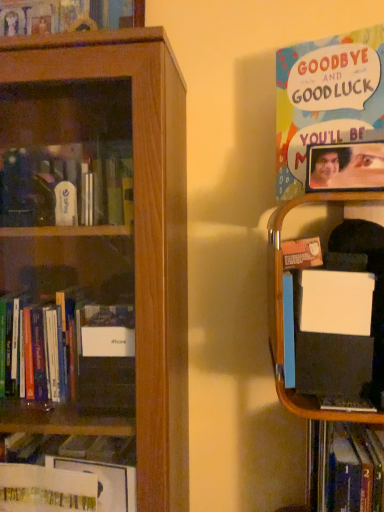
This screenshot has width=384, height=512. Find the location of `hardcover book at lower right, the first book when ordered from bottom to top`. hardcover book at lower right, the first book when ordered from bottom to top is located at coordinates (344, 468).

The height and width of the screenshot is (512, 384). Describe the element at coordinates (95, 263) in the screenshot. I see `wooden bookcase at left` at that location.

The width and height of the screenshot is (384, 512). I want to click on wooden bookcase at left, so click(95, 263).

At what (x,y) coordinates should I click in order to perform the action: click on hardcover book at lower right, marked as the second book in a top-to-bottom arrangement. Please return your answer as a coordinate pair (x, y). The height and width of the screenshot is (512, 384). Looking at the image, I should click on (344, 468).

Can you confirm if wooden bookcase at left is wider than hardcover book at lower right, marked as the second book in a top-to-bottom arrangement?

Yes, wooden bookcase at left is wider than hardcover book at lower right, marked as the second book in a top-to-bottom arrangement.

From the picture: Considering their positions, is wooden bookcase at left located in front of or behind hardcover book at lower right, the first book when ordered from bottom to top?

Visually, wooden bookcase at left is located in front of hardcover book at lower right, the first book when ordered from bottom to top.

What's the angular difference between wooden bookcase at left and hardcover book at lower right, marked as the second book in a top-to-bottom arrangement,'s facing directions?

The facing directions of wooden bookcase at left and hardcover book at lower right, marked as the second book in a top-to-bottom arrangement, are 6.29 degrees apart.

Does wooden bookcase at left turn towards hardcover book at lower right, the first book when ordered from bottom to top?

No, wooden bookcase at left is not aimed at hardcover book at lower right, the first book when ordered from bottom to top.

Is hardcover book at lower right, the first book when ordered from bottom to top, looking in the opposite direction of multicolored paper poster at upper right, the second book when ordered from bottom to top?

hardcover book at lower right, the first book when ordered from bottom to top, does not have its back to multicolored paper poster at upper right, the second book when ordered from bottom to top.

Can you confirm if hardcover book at lower right, marked as the second book in a top-to-bottom arrangement, is taller than multicolored paper poster at upper right, the second book when ordered from bottom to top?

Yes, hardcover book at lower right, marked as the second book in a top-to-bottom arrangement, is taller than multicolored paper poster at upper right, the second book when ordered from bottom to top.

Considering the positions of objects hardcover book at lower right, marked as the second book in a top-to-bottom arrangement, and multicolored paper poster at upper right, the second book when ordered from bottom to top, in the image provided, who is more to the left, hardcover book at lower right, marked as the second book in a top-to-bottom arrangement, or multicolored paper poster at upper right, the second book when ordered from bottom to top,?

Positioned to the left is multicolored paper poster at upper right, the second book when ordered from bottom to top.

From a real-world perspective, is hardcover book at lower right, marked as the second book in a top-to-bottom arrangement, physically located above or below multicolored paper poster at upper right, positioned as the first book in top-to-bottom order?

From a real-world perspective, hardcover book at lower right, marked as the second book in a top-to-bottom arrangement, is physically below multicolored paper poster at upper right, positioned as the first book in top-to-bottom order.

Is multicolored paper poster at upper right, positioned as the first book in top-to-bottom order, looking in the opposite direction of hardcover book at lower right, the first book when ordered from bottom to top?

That's not correct — multicolored paper poster at upper right, positioned as the first book in top-to-bottom order, is not looking away from hardcover book at lower right, the first book when ordered from bottom to top.

Considering the relative sizes of multicolored paper poster at upper right, positioned as the first book in top-to-bottom order, and hardcover book at lower right, the first book when ordered from bottom to top, in the image provided, is multicolored paper poster at upper right, positioned as the first book in top-to-bottom order, thinner than hardcover book at lower right, the first book when ordered from bottom to top,?

Result: Indeed, multicolored paper poster at upper right, positioned as the first book in top-to-bottom order, has a lesser width compared to hardcover book at lower right, the first book when ordered from bottom to top.

Considering the relative positions of multicolored paper poster at upper right, positioned as the first book in top-to-bottom order, and hardcover book at lower right, the first book when ordered from bottom to top, in the image provided, is multicolored paper poster at upper right, positioned as the first book in top-to-bottom order, behind hardcover book at lower right, the first book when ordered from bottom to top,?

Yes, it is behind hardcover book at lower right, the first book when ordered from bottom to top.

Can wooden picture frame at upper right be found inside hardcover book at lower right, the first book when ordered from bottom to top?

No.

Identify the location of picture frame in front of the hardcover book at lower right, the first book when ordered from bottom to top. (345, 167).

How different are the orientations of hardcover book at lower right, marked as the second book in a top-to-bottom arrangement, and wooden picture frame at upper right in degrees?

They differ by 5.22 degrees in their facing directions.

From a real-world perspective, is hardcover book at lower right, marked as the second book in a top-to-bottom arrangement, positioned above or below wooden picture frame at upper right?

hardcover book at lower right, marked as the second book in a top-to-bottom arrangement, is below wooden picture frame at upper right.

Could you tell me if hardcover book at lower right, the first book when ordered from bottom to top, is turned towards wooden bookcase at left?

No, hardcover book at lower right, the first book when ordered from bottom to top, is not oriented towards wooden bookcase at left.

Considering the relative sizes of hardcover book at lower right, marked as the second book in a top-to-bottom arrangement, and wooden bookcase at left in the image provided, is hardcover book at lower right, marked as the second book in a top-to-bottom arrangement, smaller than wooden bookcase at left?

Yes, hardcover book at lower right, marked as the second book in a top-to-bottom arrangement, is smaller than wooden bookcase at left.

Is hardcover book at lower right, the first book when ordered from bottom to top, to the left or to the right of wooden bookcase at left in the image?

Clearly, hardcover book at lower right, the first book when ordered from bottom to top, is on the right of wooden bookcase at left in the image.

Is point (315, 437) positioned in front of point (136, 111)?

That is False.

Considering the sizes of wooden bookcase at left and wooden picture frame at upper right in the image, is wooden bookcase at left wider or thinner than wooden picture frame at upper right?

wooden bookcase at left is wider than wooden picture frame at upper right.

Considering the relative sizes of wooden bookcase at left and wooden picture frame at upper right in the image provided, is wooden bookcase at left smaller than wooden picture frame at upper right?

Incorrect, wooden bookcase at left is not smaller in size than wooden picture frame at upper right.

Considering the relative positions of wooden bookcase at left and wooden picture frame at upper right in the image provided, is wooden bookcase at left to the right of wooden picture frame at upper right from the viewer's perspective?

No, wooden bookcase at left is not to the right of wooden picture frame at upper right.

Is wooden bookcase at left looking in the opposite direction of wooden picture frame at upper right?

That's not correct — wooden bookcase at left is not looking away from wooden picture frame at upper right.

Can you confirm if wooden picture frame at upper right is taller than hardcover book at lower right, marked as the second book in a top-to-bottom arrangement?

No.

Could you tell me if wooden picture frame at upper right is turned towards hardcover book at lower right, the first book when ordered from bottom to top?

No, wooden picture frame at upper right is not aimed at hardcover book at lower right, the first book when ordered from bottom to top.

Where is `picture frame above the hardcover book at lower right, marked as the second book in a top-to-bottom arrangement (from a real-world perspective)`? picture frame above the hardcover book at lower right, marked as the second book in a top-to-bottom arrangement (from a real-world perspective) is located at coordinates (345, 167).

Where is `bookcase in front of the hardcover book at lower right, marked as the second book in a top-to-bottom arrangement`? This screenshot has height=512, width=384. bookcase in front of the hardcover book at lower right, marked as the second book in a top-to-bottom arrangement is located at coordinates (95, 263).

Identify the location of book above the hardcover book at lower right, the first book when ordered from bottom to top (from the image's perspective). (326, 98).

Based on the photo, looking at the image, which one is located further to wooden bookcase at left, hardcover book at lower right, the first book when ordered from bottom to top, or multicolored paper poster at upper right, positioned as the first book in top-to-bottom order?

hardcover book at lower right, the first book when ordered from bottom to top, lies further to wooden bookcase at left than the other object.

Which object lies further to the anchor point multicolored paper poster at upper right, the second book when ordered from bottom to top, wooden picture frame at upper right or hardcover book at lower right, the first book when ordered from bottom to top?

hardcover book at lower right, the first book when ordered from bottom to top, is positioned further to the anchor multicolored paper poster at upper right, the second book when ordered from bottom to top.

Based on their spatial positions, is hardcover book at lower right, the first book when ordered from bottom to top, or wooden picture frame at upper right further from wooden bookcase at left?

The object further to wooden bookcase at left is hardcover book at lower right, the first book when ordered from bottom to top.

When comparing their distances from multicolored paper poster at upper right, positioned as the first book in top-to-bottom order, does wooden bookcase at left or wooden picture frame at upper right seem further?

Based on the image, wooden bookcase at left appears to be further to multicolored paper poster at upper right, positioned as the first book in top-to-bottom order.

From the image, which object appears to be farther from wooden picture frame at upper right, hardcover book at lower right, the first book when ordered from bottom to top, or multicolored paper poster at upper right, the second book when ordered from bottom to top?

Based on the image, hardcover book at lower right, the first book when ordered from bottom to top, appears to be further to wooden picture frame at upper right.

Based on their spatial positions, is hardcover book at lower right, marked as the second book in a top-to-bottom arrangement, or wooden picture frame at upper right closer to multicolored paper poster at upper right, the second book when ordered from bottom to top?

The object closer to multicolored paper poster at upper right, the second book when ordered from bottom to top, is wooden picture frame at upper right.

Based on their spatial positions, is multicolored paper poster at upper right, the second book when ordered from bottom to top, or wooden bookcase at left closer to wooden picture frame at upper right?

Based on the image, multicolored paper poster at upper right, the second book when ordered from bottom to top, appears to be nearer to wooden picture frame at upper right.

Which object lies further to the anchor point wooden picture frame at upper right, wooden bookcase at left or hardcover book at lower right, the first book when ordered from bottom to top?

wooden bookcase at left is positioned further to the anchor wooden picture frame at upper right.

Where is `book between wooden bookcase at left and wooden picture frame at upper right in the horizontal direction`? book between wooden bookcase at left and wooden picture frame at upper right in the horizontal direction is located at coordinates (326, 98).

The width and height of the screenshot is (384, 512). I want to click on picture frame between wooden bookcase at left and hardcover book at lower right, marked as the second book in a top-to-bottom arrangement, in the horizontal direction, so 345,167.

Find the location of `bookcase that lies between multicolored paper poster at upper right, positioned as the first book in top-to-bottom order, and hardcover book at lower right, marked as the second book in a top-to-bottom arrangement, from top to bottom`. bookcase that lies between multicolored paper poster at upper right, positioned as the first book in top-to-bottom order, and hardcover book at lower right, marked as the second book in a top-to-bottom arrangement, from top to bottom is located at coordinates (95, 263).

Find the location of a particular element. The width and height of the screenshot is (384, 512). picture frame between multicolored paper poster at upper right, positioned as the first book in top-to-bottom order, and hardcover book at lower right, marked as the second book in a top-to-bottom arrangement, in the vertical direction is located at coordinates (345, 167).